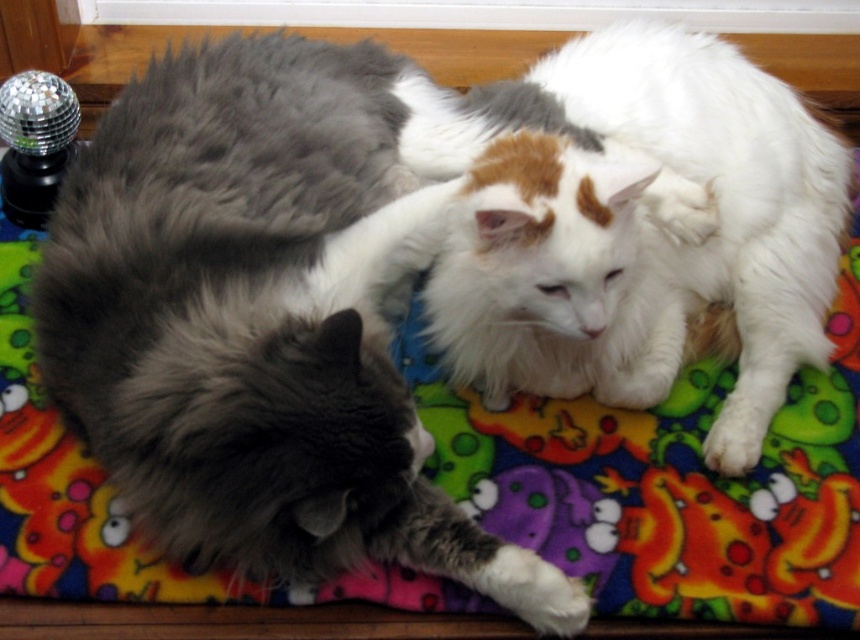
You are standing 5 feet away from the blanket where the cats are resting. There is a point at coordinates point (355, 321). Can you reach this point without moving closer than 3.50 feet?

The distance of point (355, 321) from viewer is 3.50 feet. Since you are already standing 5 feet away, you are farther than the required 3.50 feet, so you cannot reach the point without moving closer.

You are a photographer trying to capture a closeup shot of both the fluffy gray cat at center and the white fluffy cat at center. Given that your camera lens has a maximum focus range of 10 inches, will you be able to focus on both cats simultaneously?

The fluffy gray cat at center and the white fluffy cat at center are 10.57 inches apart from each other. Since the distance between them exceeds the camera lens maximum focus range of 10 inches, you cannot focus on both cats simultaneously.

Based on the scene description, which cat is taller between the fluffy gray cat at center and the white fluffy cat at center?

The fluffy gray cat at center is taller than the white fluffy cat at center according to the description.